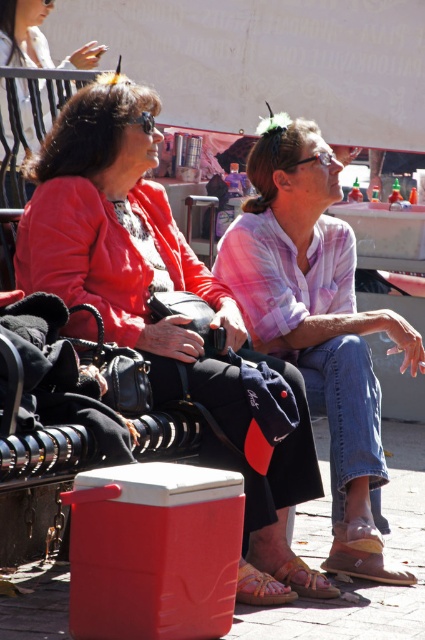
Question: Which point is farther from the camera taking this photo?

Choices:
 (A) (260, 602)
 (B) (257, 525)
 (C) (300, 584)

Answer: (C)

Question: Considering the real-world distances, which object is farthest from the brown leather sandal at lower center?

Choices:
 (A) matte black jacket at center
 (B) leather textured sandal at lower center

Answer: (A)

Question: Can you confirm if matte black jacket at center is positioned to the left of leather textured sandal at lower center?

Choices:
 (A) yes
 (B) no

Answer: (A)

Question: Which object is farther from the camera taking this photo?

Choices:
 (A) denim jeans at center
 (B) matte black jacket at center
 (C) brown leather sandal at lower center
 (D) leather textured sandal at lower center

Answer: (A)

Question: Does denim jeans at center lie in front of leather textured sandal at lower center?

Choices:
 (A) no
 (B) yes

Answer: (A)

Question: Does matte black jacket at center appear under denim jeans at center?

Choices:
 (A) no
 (B) yes

Answer: (A)